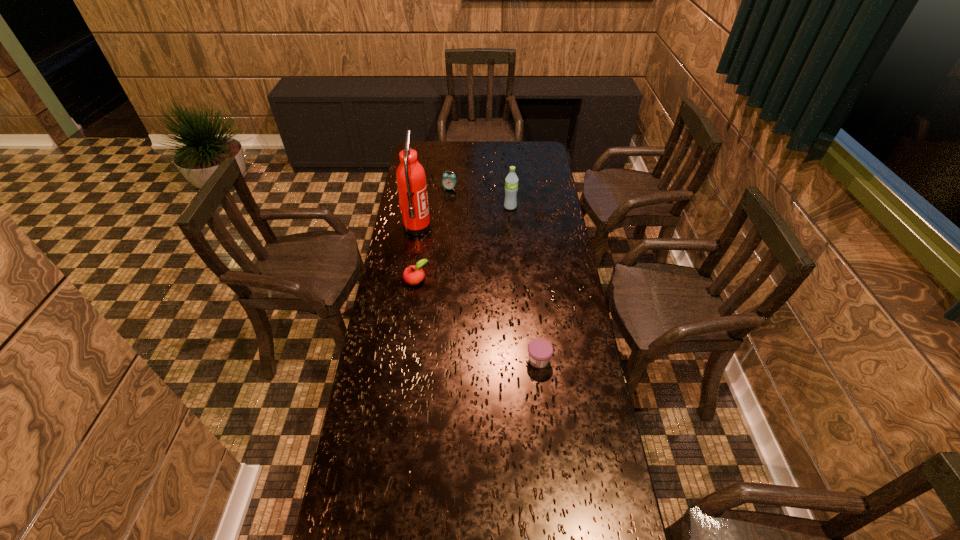
In order to click on vacant region located on the face of the alarm clock in this screenshot , I will do `click(448, 207)`.

Where is `free point located 0.310m on the right of the apple`? The height and width of the screenshot is (540, 960). free point located 0.310m on the right of the apple is located at coordinates click(x=507, y=280).

This screenshot has width=960, height=540. What are the coordinates of `free space located on the front label of the jam` in the screenshot? It's located at (497, 360).

The image size is (960, 540). Find the location of `vacant region located on the front label of the jam`. vacant region located on the front label of the jam is located at coordinates (444, 360).

Identify the location of vacant space positioned on the front label of the jam. This screenshot has width=960, height=540. pyautogui.click(x=415, y=360).

Identify the location of fire extinguisher that is at the left edge. The width and height of the screenshot is (960, 540). [x=411, y=180].

Locate an element on the screen. This screenshot has height=540, width=960. apple positioned at the left edge is located at coordinates (414, 274).

In order to click on object located at the right edge in this screenshot , I will do (x=540, y=351).

Locate an element on the screen. The height and width of the screenshot is (540, 960). vacant space at the left edge of the desktop is located at coordinates (387, 494).

Image resolution: width=960 pixels, height=540 pixels. Identify the location of vacant region at the right edge of the desktop. (553, 171).